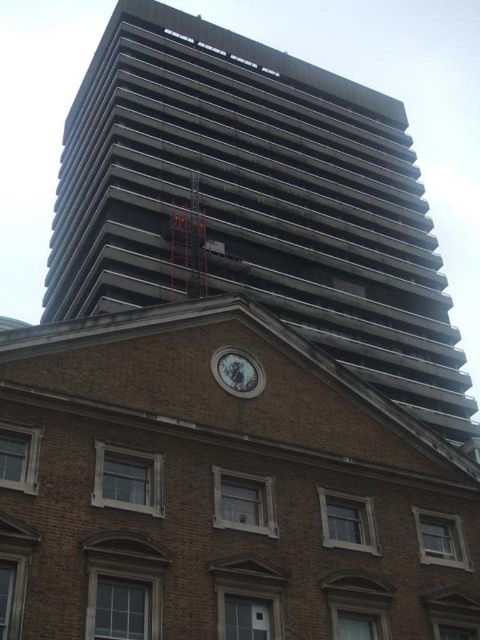
Question: Which point appears closest to the camera in this image?

Choices:
 (A) (223, 364)
 (B) (392, 198)

Answer: (A)

Question: Can you confirm if dark gray concrete building at upper center is thinner than white glossy clock at center?

Choices:
 (A) no
 (B) yes

Answer: (A)

Question: Is dark gray concrete building at upper center above white glossy clock at center?

Choices:
 (A) no
 (B) yes

Answer: (B)

Question: Considering the relative positions of dark gray concrete building at upper center and white glossy clock at center in the image provided, where is dark gray concrete building at upper center located with respect to white glossy clock at center?

Choices:
 (A) above
 (B) below

Answer: (A)